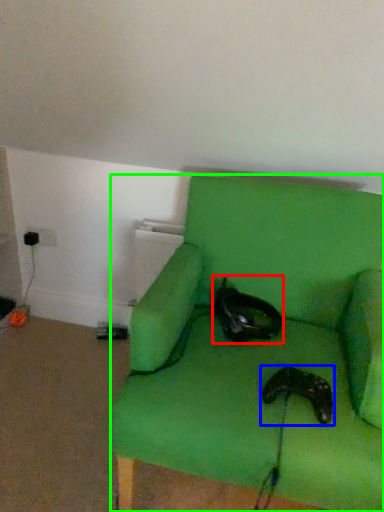
Question: Which object is positioned closest to cat (highlighted by a red box)? Select from footwear (highlighted by a blue box) and chair (highlighted by a green box).

Choices:
 (A) footwear
 (B) chair

Answer: (B)